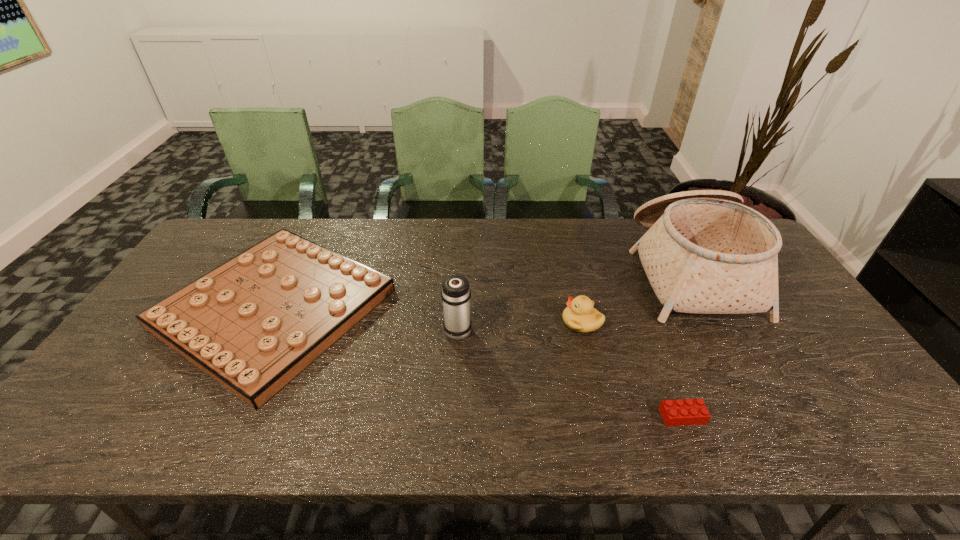
Locate an element on the screen. This screenshot has width=960, height=540. basket is located at coordinates (705, 252).

This screenshot has width=960, height=540. Find the location of `thermos bottle`. thermos bottle is located at coordinates (455, 293).

This screenshot has width=960, height=540. Find the location of `the second tallest object`. the second tallest object is located at coordinates (455, 293).

This screenshot has width=960, height=540. Identify the location of duckling. (580, 316).

Find the location of `the third shortest object`. the third shortest object is located at coordinates (580, 316).

Find the location of a particular element. the leftmost object is located at coordinates (253, 323).

The width and height of the screenshot is (960, 540). I want to click on the second shortest object, so click(253, 323).

Where is `Lego`? The height and width of the screenshot is (540, 960). Lego is located at coordinates (681, 412).

Locate an element on the screen. vacant space located 0.200m with the lid open on the basket is located at coordinates click(x=572, y=270).

The width and height of the screenshot is (960, 540). In order to click on blank area located 0.310m with the lid open on the basket in this screenshot , I will do `click(537, 270)`.